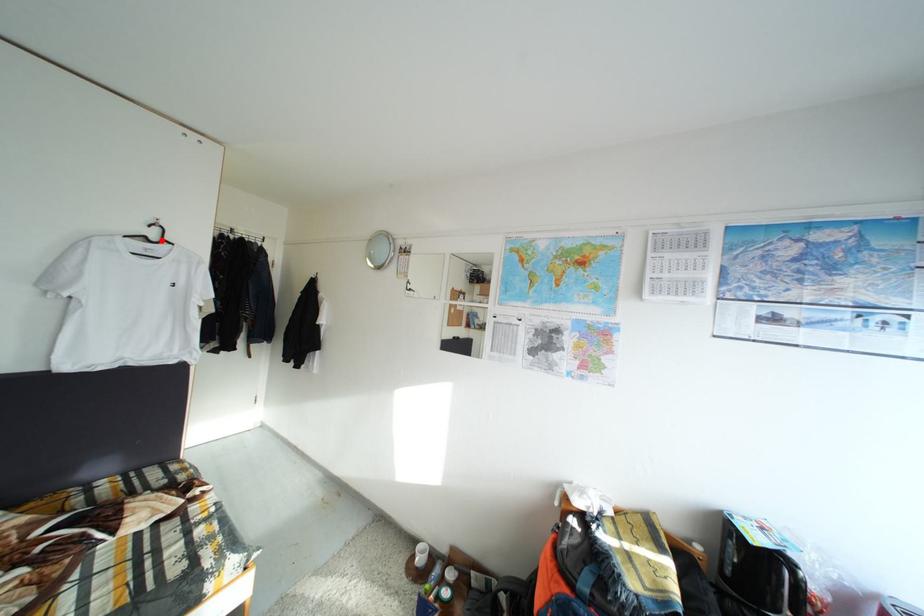
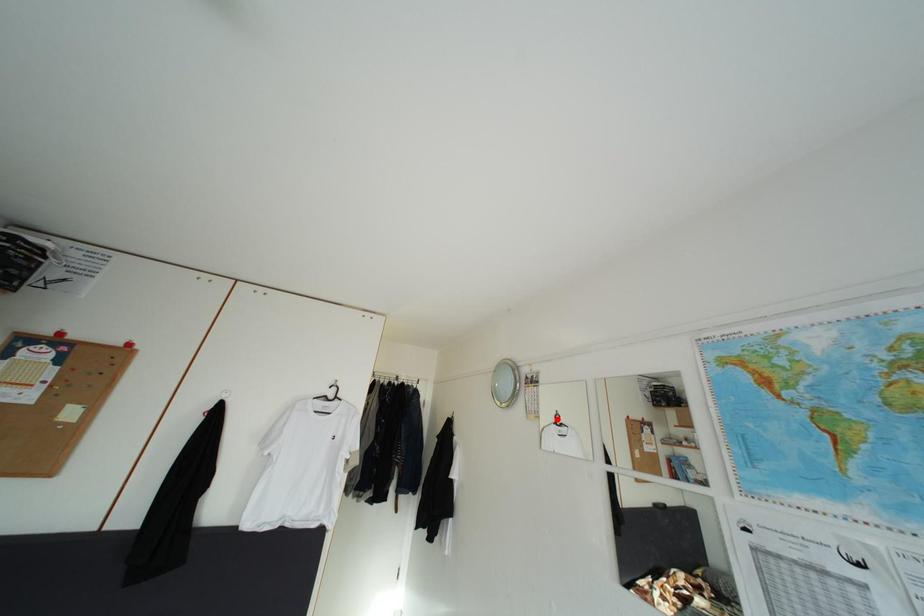
I am providing you with two images of the same scene from different viewpoints. A red point is marked on the first image and another point is marked on the second image. Is the red point in image1 aligned with the point shown in image2?

No